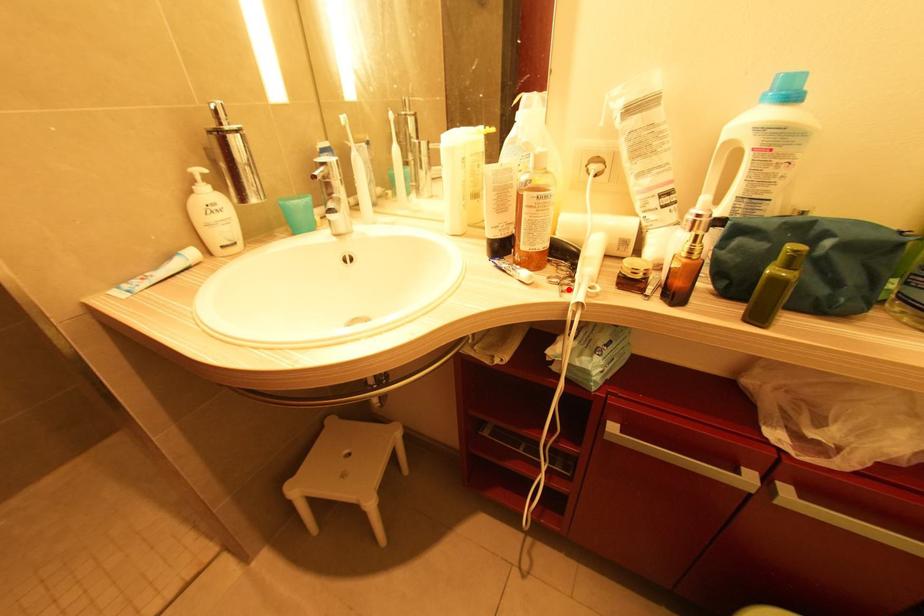
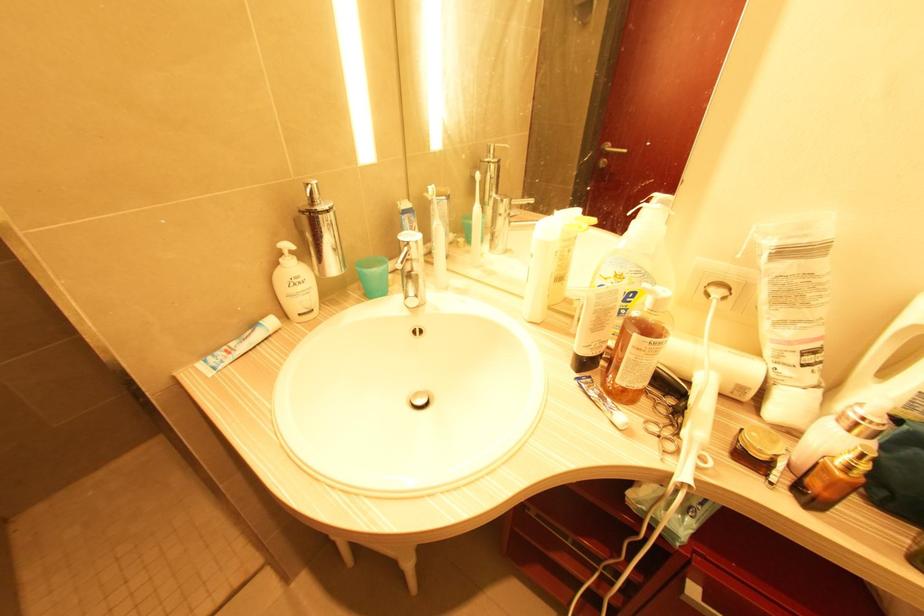
In the second image, find the point that corresponds to the highlighted location in the first image.

(671, 448)